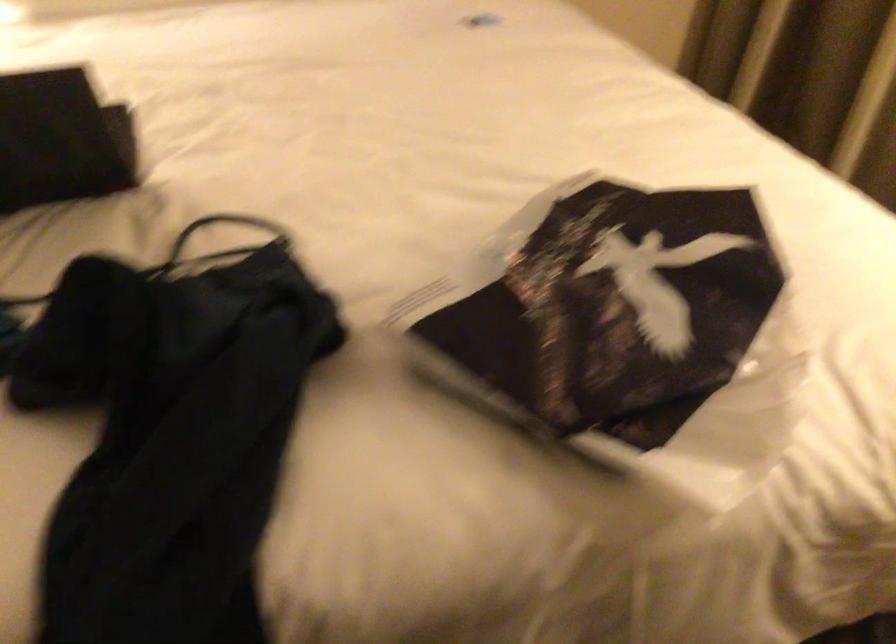
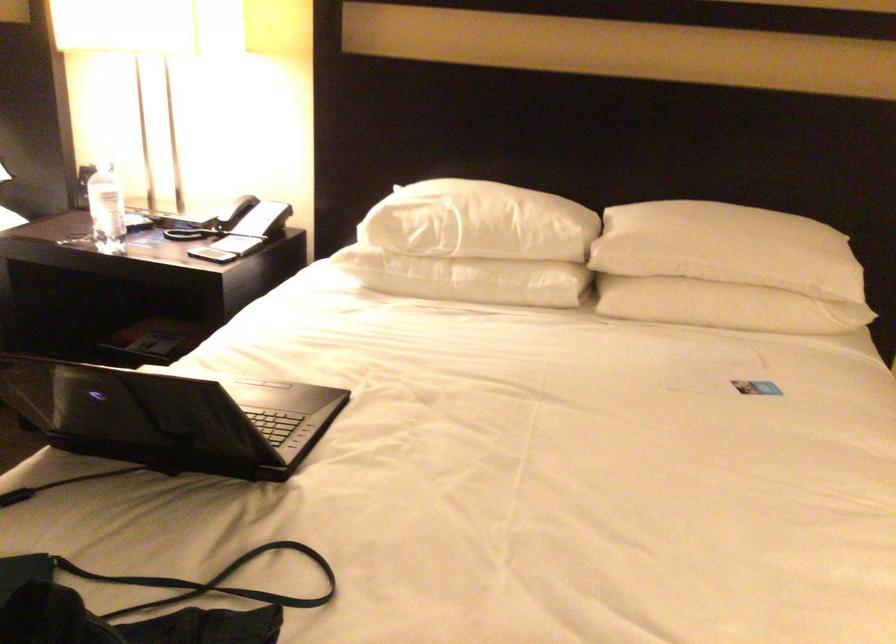
Locate, in the second image, the point that corresponds to pixel 168 267 in the first image.

(211, 581)